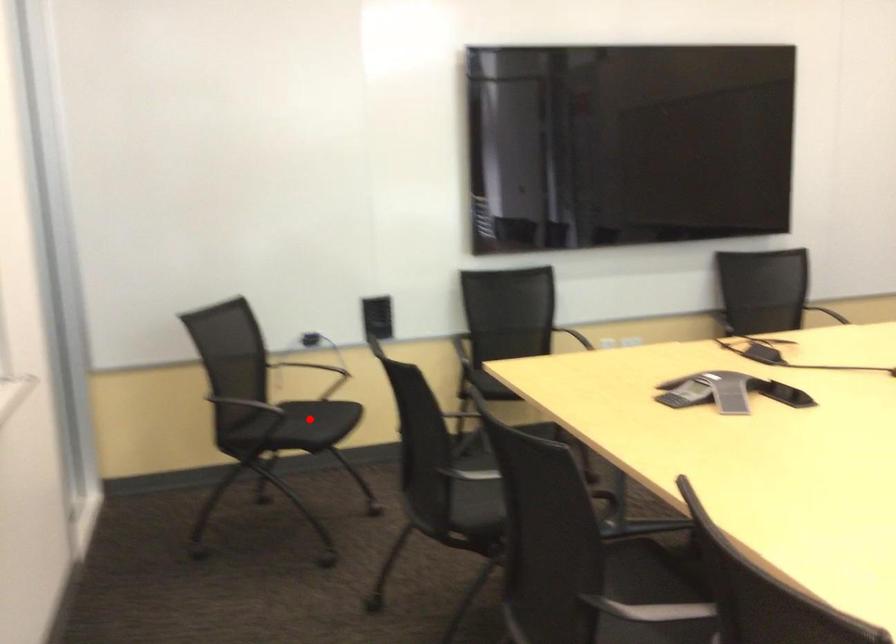
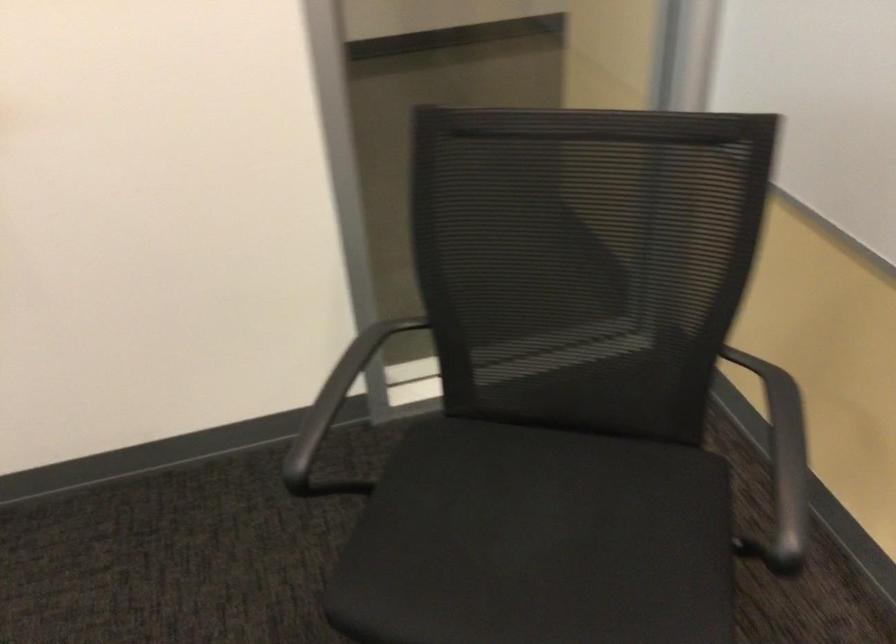
In the second image, find the point that corresponds to the highlighted location in the first image.

(538, 542)